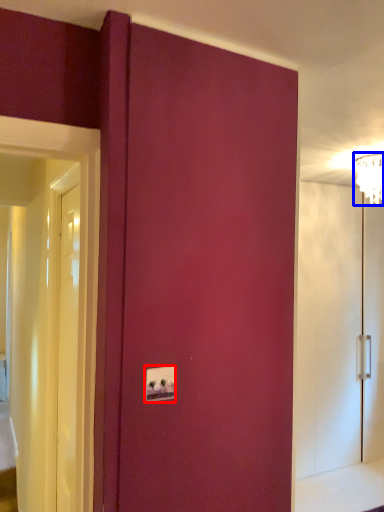
Question: Which of the following is the farthest to the observer, light switch (highlighted by a red box) or light fixture (highlighted by a blue box)?

Choices:
 (A) light switch
 (B) light fixture

Answer: (B)